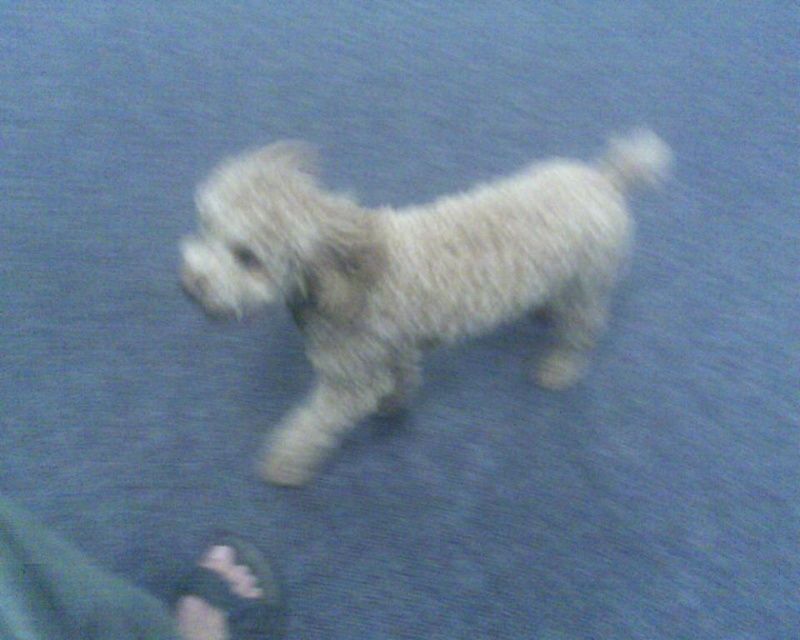
Question: Which of the following is the closest to the observer?

Choices:
 (A) black fabric sandal at lower left
 (B) white fluffy dog at center
 (C) green fabric pants at lower left

Answer: (C)

Question: Which object is farther from the camera taking this photo?

Choices:
 (A) white fluffy dog at center
 (B) black fabric sandal at lower left
 (C) green fabric pants at lower left

Answer: (B)

Question: Which object appears closest to the camera in this image?

Choices:
 (A) green fabric pants at lower left
 (B) black fabric sandal at lower left

Answer: (A)

Question: Does white fluffy dog at center have a lesser width compared to green fabric pants at lower left?

Choices:
 (A) yes
 (B) no

Answer: (B)

Question: Where is green fabric pants at lower left located in relation to black fabric sandal at lower left in the image?

Choices:
 (A) right
 (B) left

Answer: (A)

Question: Can you confirm if green fabric pants at lower left is positioned to the right of black fabric sandal at lower left?

Choices:
 (A) yes
 (B) no

Answer: (A)